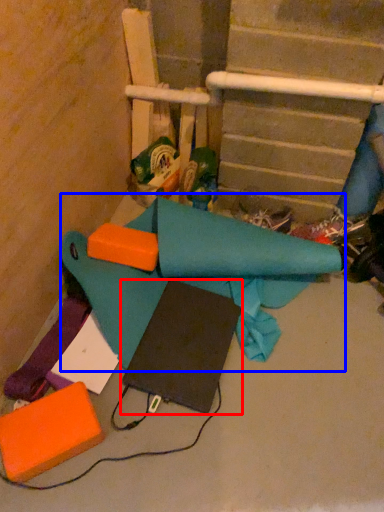
Question: Among these objects, which one is nearest to the camera, notebook (highlighted by a red box) or fabric (highlighted by a blue box)?

Choices:
 (A) notebook
 (B) fabric

Answer: (B)